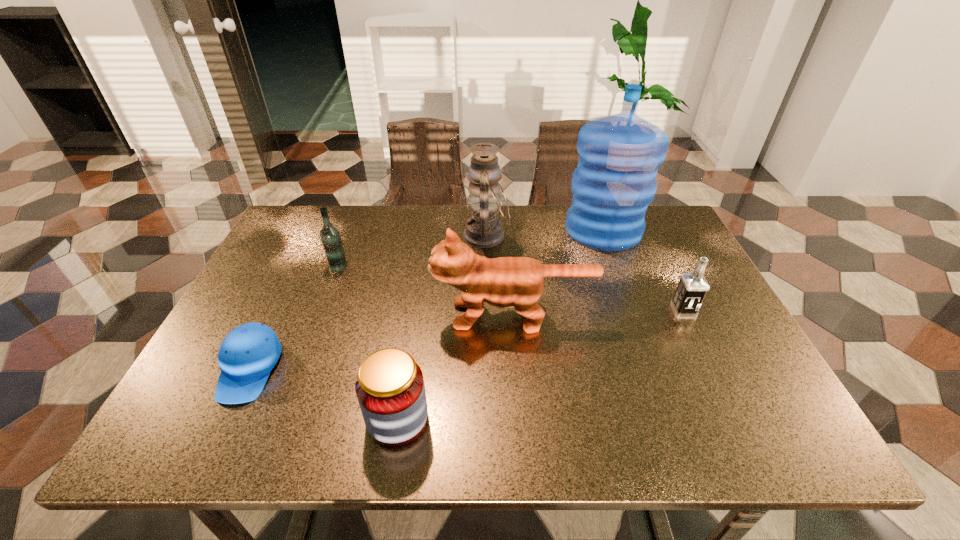
The image size is (960, 540). In order to click on free space located 0.290m on the left of the second tallest object in this screenshot , I will do `click(368, 236)`.

Where is `vacant area situated on the face of the cat`? Image resolution: width=960 pixels, height=540 pixels. vacant area situated on the face of the cat is located at coordinates (396, 315).

You are a GUI agent. You are given a task and a screenshot of the screen. Output one action in this format:
    pyautogui.click(x=<x>, y=<y>)
    Task: Click on the vacant space located on the face of the cat
    This screenshot has height=540, width=960.
    Given the screenshot: What is the action you would take?
    pyautogui.click(x=315, y=315)

Locate an element on the screen. blank area located on the face of the cat is located at coordinates (388, 315).

Find the location of a particular element. The height and width of the screenshot is (540, 960). vacant position located on the right of the farther vodka is located at coordinates (468, 265).

You are a GUI agent. You are given a task and a screenshot of the screen. Output one action in this format:
    pyautogui.click(x=<x>, y=<y>)
    Task: Click on the free space located 0.060m on the front label of the nearer vodka
    The image size is (960, 540).
    Given the screenshot: What is the action you would take?
    pyautogui.click(x=696, y=336)

The image size is (960, 540). I want to click on vacant space situated on the right of the jar, so click(459, 418).

Identify the location of free point located on the front-facing side of the leftmost object. The width and height of the screenshot is (960, 540). (216, 438).

I want to click on water jug that is at the far edge, so click(x=619, y=155).

Where is `oil lamp located in the far edge section of the desktop`? The height and width of the screenshot is (540, 960). oil lamp located in the far edge section of the desktop is located at coordinates (483, 230).